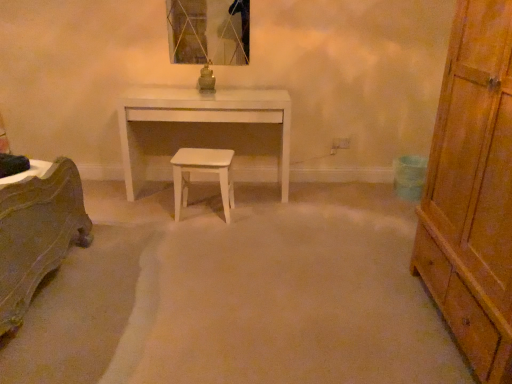
Question: Considering the relative positions of white matte stool at center and white glossy desk at center in the image provided, is white matte stool at center to the right of white glossy desk at center from the viewer's perspective?

Choices:
 (A) no
 (B) yes

Answer: (B)

Question: Is white matte stool at center not within white glossy desk at center?

Choices:
 (A) no
 (B) yes

Answer: (B)

Question: Is white glossy desk at center located within white matte stool at center?

Choices:
 (A) no
 (B) yes

Answer: (A)

Question: From the image's perspective, is white matte stool at center on top of white glossy desk at center?

Choices:
 (A) yes
 (B) no

Answer: (B)

Question: Considering the relative positions of white matte stool at center and white glossy desk at center in the image provided, is white matte stool at center to the left of white glossy desk at center from the viewer's perspective?

Choices:
 (A) no
 (B) yes

Answer: (A)

Question: Considering the relative sizes of white matte stool at center and white glossy desk at center in the image provided, is white matte stool at center thinner than white glossy desk at center?

Choices:
 (A) no
 (B) yes

Answer: (B)

Question: Would you say white glossy desk at center is a long distance from wooden chest of drawers at right?

Choices:
 (A) no
 (B) yes

Answer: (B)

Question: From the image's perspective, is white glossy desk at center below wooden chest of drawers at right?

Choices:
 (A) yes
 (B) no

Answer: (B)

Question: Is white glossy desk at center facing towards wooden chest of drawers at right?

Choices:
 (A) yes
 (B) no

Answer: (B)

Question: Does white glossy desk at center have a greater width compared to wooden chest of drawers at right?

Choices:
 (A) yes
 (B) no

Answer: (B)

Question: From a real-world perspective, is white glossy desk at center on top of wooden chest of drawers at right?

Choices:
 (A) no
 (B) yes

Answer: (A)

Question: Is white glossy desk at center located outside wooden chest of drawers at right?

Choices:
 (A) no
 (B) yes

Answer: (B)

Question: Is metallic glass mirror at upper center bigger than white glossy desk at center?

Choices:
 (A) no
 (B) yes

Answer: (A)